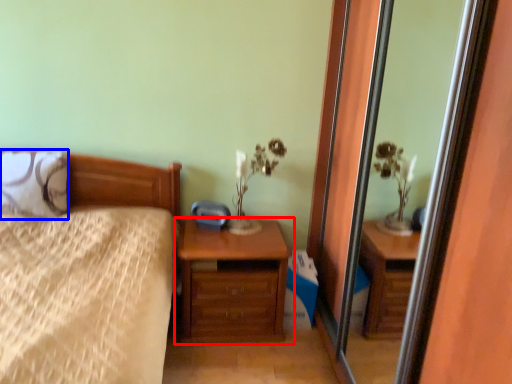
Question: Which of the following is the closest to the observer, chest of drawers (highlighted by a red box) or pillow (highlighted by a blue box)?

Choices:
 (A) chest of drawers
 (B) pillow

Answer: (B)